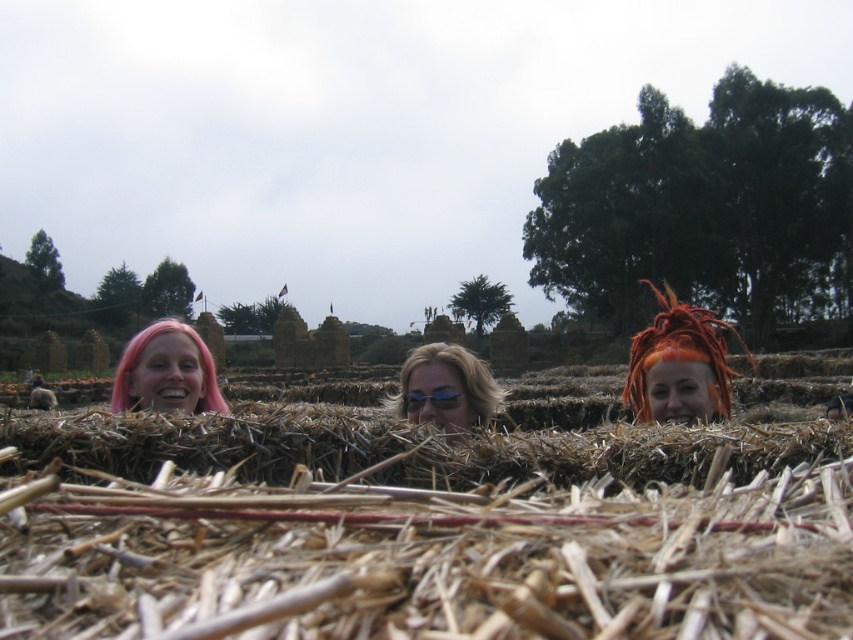
Who is taller, pastel pink hair at left or shiny blue sunglasses at center?

Standing taller between the two is shiny blue sunglasses at center.

Which of these two, pastel pink hair at left or shiny blue sunglasses at center, stands shorter?

pastel pink hair at left

Identify the location of pastel pink hair at left. (166, 371).

Who is shorter, pastel pink hair at left or sunglasses at center?

With less height is sunglasses at center.

Is pastel pink hair at left smaller than sunglasses at center?

Incorrect, pastel pink hair at left is not smaller in size than sunglasses at center.

Between point (170, 323) and point (448, 388), which one is positioned in front?

Point (448, 388) is more forward.

Where is `pastel pink hair at left`? The image size is (853, 640). pastel pink hair at left is located at coordinates (166, 371).

Between orange dreadlocks at center and pastel pink hair at left, which one appears on the left side from the viewer's perspective?

Positioned to the left is pastel pink hair at left.

Who is shorter, orange dreadlocks at center or pastel pink hair at left?

pastel pink hair at left

Locate an element on the screen. The width and height of the screenshot is (853, 640). orange dreadlocks at center is located at coordinates (679, 353).